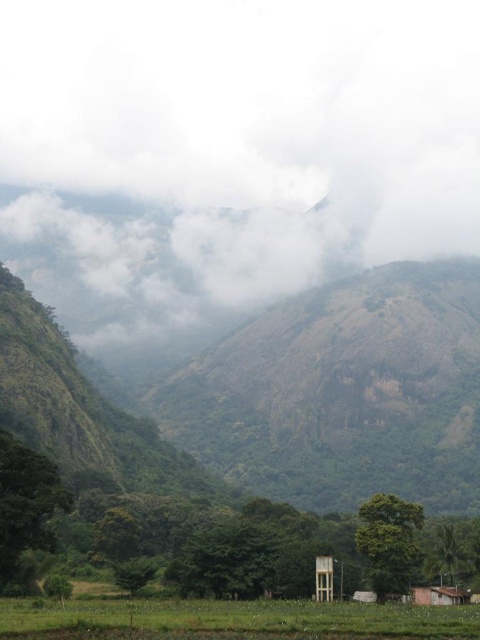
Question: Among these objects, which one is farthest from the camera?

Choices:
 (A) brown wooden hut at lower right
 (B) white fluffy cloud at upper center
 (C) green grassy rice field at lower center

Answer: (B)

Question: Where is white fluffy cloud at upper center located in relation to green grassy rice field at lower center in the image?

Choices:
 (A) right
 (B) left

Answer: (B)

Question: Is white fluffy cloud at upper center to the right of green grassy rice field at lower center from the viewer's perspective?

Choices:
 (A) no
 (B) yes

Answer: (A)

Question: Which object appears closest to the camera in this image?

Choices:
 (A) green grassy rice field at lower center
 (B) white fluffy cloud at upper center
 (C) brown wooden hut at lower right

Answer: (A)

Question: Which of the following is the closest to the observer?

Choices:
 (A) pos(462,602)
 (B) pos(328,54)

Answer: (A)

Question: Is white fluffy cloud at upper center to the left of green grassy rice field at lower center from the viewer's perspective?

Choices:
 (A) yes
 (B) no

Answer: (A)